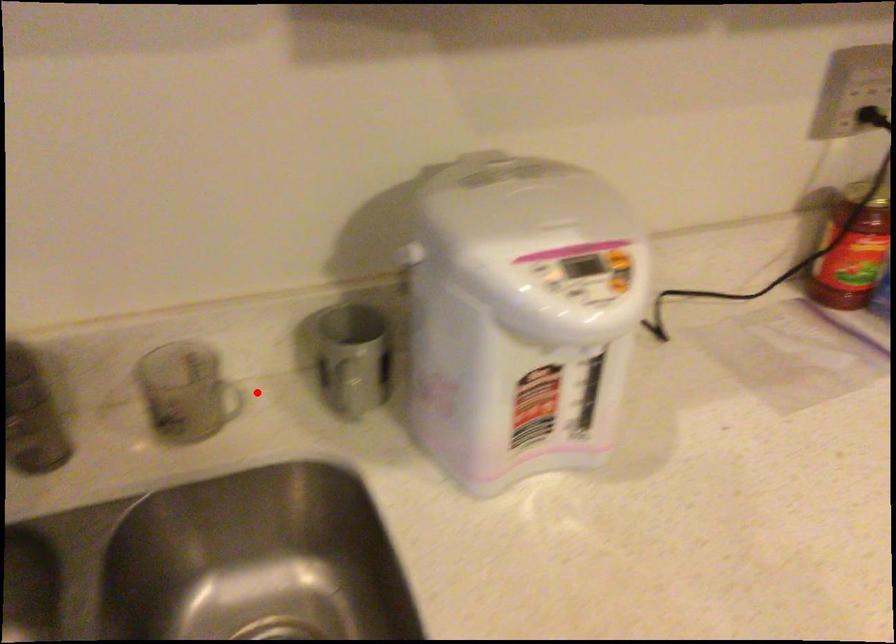
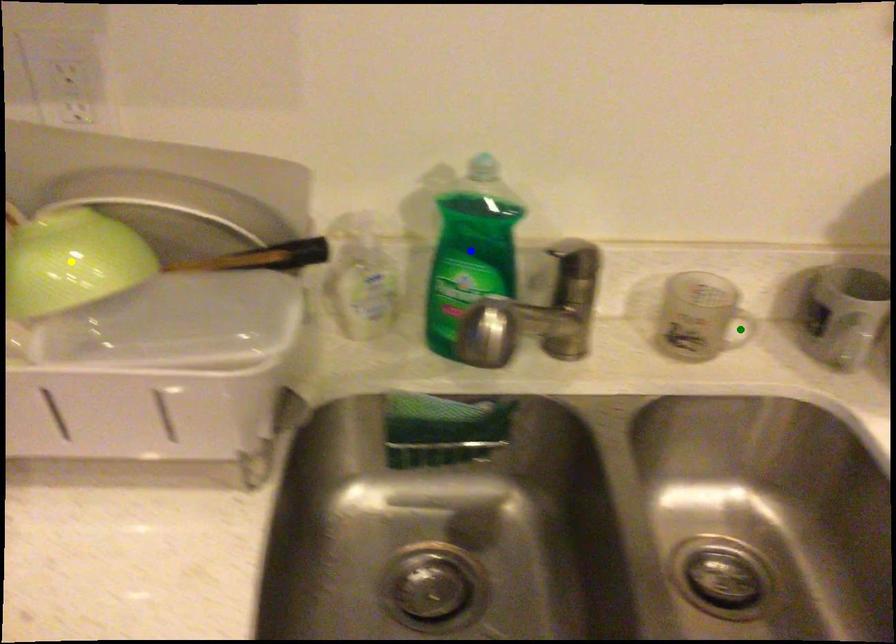
Question: I am providing you with two images of the same scene from different viewpoints. A red point is marked on the first image. You are given multiple points on the second image. In image 2, which mark is for the same physical point as the one in image 1?

Choices:
 (A) yellow point
 (B) blue point
 (C) green point

Answer: (C)